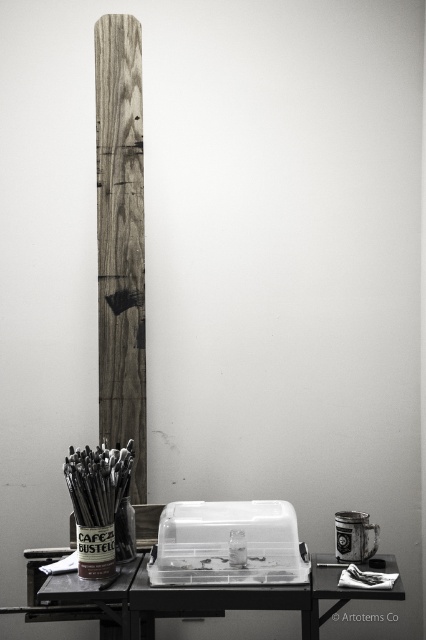
You are an interior designer assessing the space shown. You need to determine if the wooden plank at left can be placed horizontally on top of the black plastic table at lower center without exceeding its length. Can it fit?

The wooden plank at left is much taller than the black plastic table at lower center. Since the plank is taller, when placed horizontally, its length would exceed the table top, so it cannot fit.

You are organizing a storage area and need to determine which item takes up more space. Based on the scene, which occupies more space between the wooden plank at left and the black plastic table at lower center?

The black plastic table at lower center occupies more space than the wooden plank at left according to the description.

You are an artist standing in front of the wooden plank at left and the black plastic table at lower center. Which object is closer to you?

The wooden plank at left is closer to you because it is further to the viewer than the black plastic table at lower center.